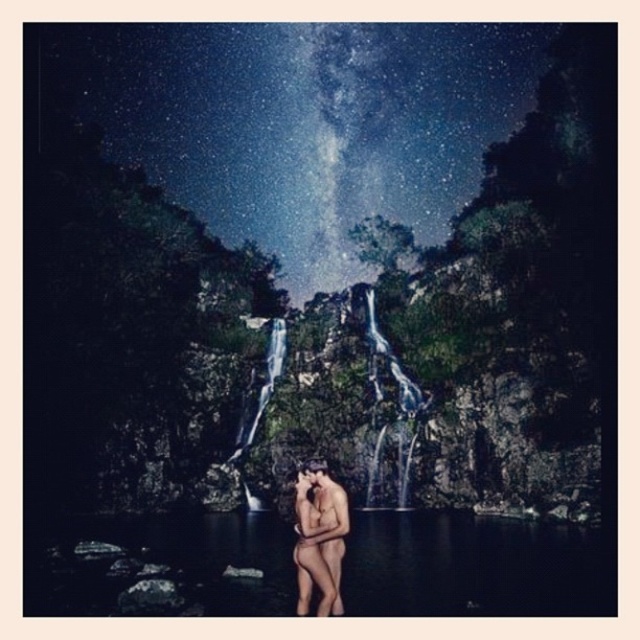
Between point (163, 550) and point (326, 509), which one is positioned in front?

Point (326, 509) is more forward.

Can you confirm if transparent water at center is smaller than smooth skin man at center?

No, transparent water at center is not smaller than smooth skin man at center.

Where is `transparent water at center`? This screenshot has width=640, height=640. transparent water at center is located at coordinates (474, 566).